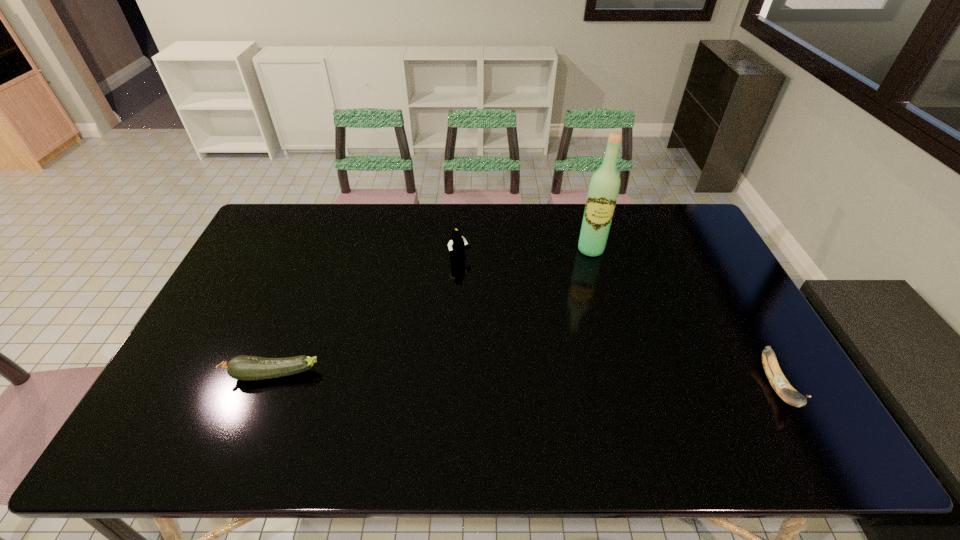
The width and height of the screenshot is (960, 540). In order to click on the shortest object in this screenshot , I will do `click(247, 368)`.

Locate an element on the screen. zucchini is located at coordinates (247, 368).

This screenshot has height=540, width=960. What are the coordinates of `banana` in the screenshot? It's located at pyautogui.click(x=778, y=381).

Locate an element on the screen. the third tallest object is located at coordinates click(778, 381).

Find the location of `Lego`. Lego is located at coordinates (456, 245).

Find the location of `the second tallest object`. the second tallest object is located at coordinates (456, 245).

Identify the location of the third object from left to right. The image size is (960, 540). (604, 186).

The width and height of the screenshot is (960, 540). Find the location of `the tallest object`. the tallest object is located at coordinates pos(604,186).

Find the location of a particular element. This screenshot has width=960, height=540. vacant space located 0.130m at the blossom end of the shortest object is located at coordinates (177, 375).

The height and width of the screenshot is (540, 960). I want to click on vacant region located at the blossom end of the shortest object, so click(x=192, y=375).